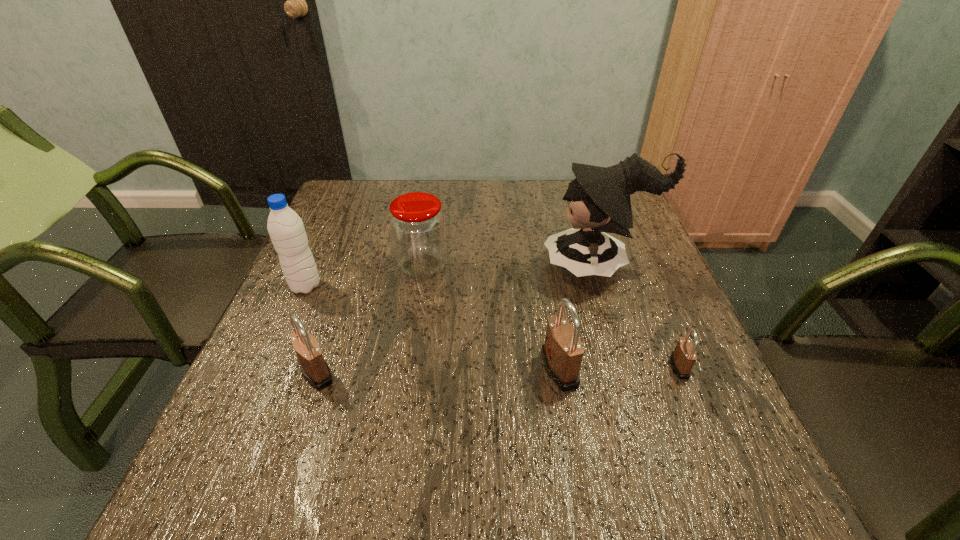
At what (x,y) coordinates should I click in order to perform the action: click on vacant area situated 0.220m on the right of the second padlock from right to left. Please return your answer as a coordinate pair (x, y). The width and height of the screenshot is (960, 540). Looking at the image, I should click on (688, 369).

Locate an element on the screen. vacant space located 0.310m on the back of the shortest object is located at coordinates (634, 258).

At what (x,y) coordinates should I click in order to perform the action: click on vacant space situated 0.080m at the face of the tallest object. Please return your answer as a coordinate pair (x, y). Looking at the image, I should click on (512, 266).

Where is `free space located at the face of the tallest object`? free space located at the face of the tallest object is located at coordinates [512, 266].

Identify the location of vacant space located at the face of the tallest object. (455, 266).

Where is `vacant space located 0.060m on the front of the fourth object from right to left`? vacant space located 0.060m on the front of the fourth object from right to left is located at coordinates (417, 299).

The image size is (960, 540). In order to click on free space located on the right of the fifth shortest object in this screenshot , I will do `click(393, 286)`.

This screenshot has height=540, width=960. Identify the location of padlock situated at the left edge. (315, 370).

Where is `water bottle situated at the left edge`? water bottle situated at the left edge is located at coordinates (285, 227).

What are the coordinates of `padlock positioned at the right edge` in the screenshot? It's located at (683, 358).